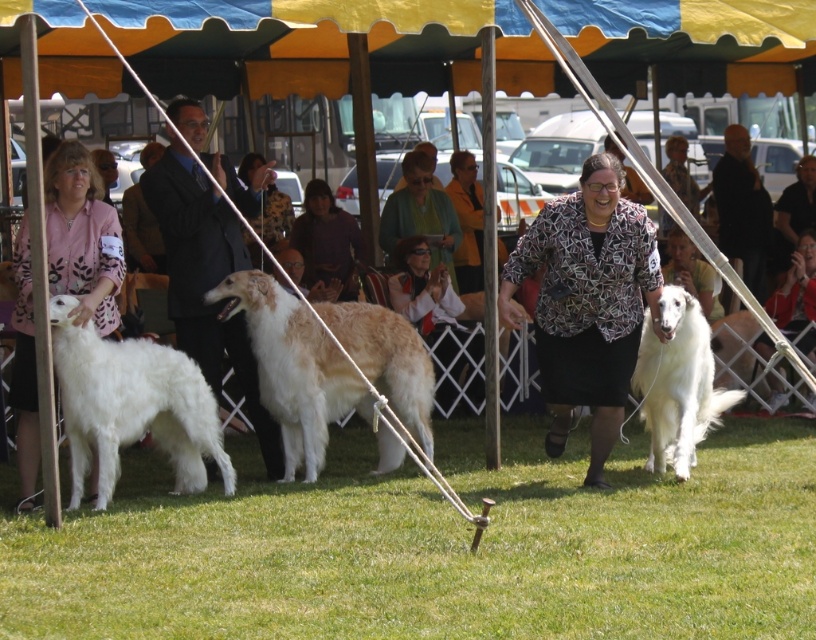
Question: Among these objects, which one is nearest to the camera?

Choices:
 (A) green grass at lower center
 (B) printed fabric blouse at center

Answer: (B)

Question: Which point is closer to the camera taking this photo?

Choices:
 (A) (91, 282)
 (B) (242, 182)
 (C) (655, 627)
 (D) (285, 467)

Answer: (C)

Question: Does green grass at lower center appear on the right side of matte black dress at center?

Choices:
 (A) no
 (B) yes

Answer: (A)

Question: Which of the following is the closest to the observer?

Choices:
 (A) dark suit at center
 (B) green grass at lower center

Answer: (B)

Question: Observing the image, what is the correct spatial positioning of golden fur dog at center in reference to matte pink blouse at left?

Choices:
 (A) below
 (B) above

Answer: (A)

Question: Can you confirm if green grass at lower center is positioned to the left of golden fur dog at center?

Choices:
 (A) no
 (B) yes

Answer: (A)